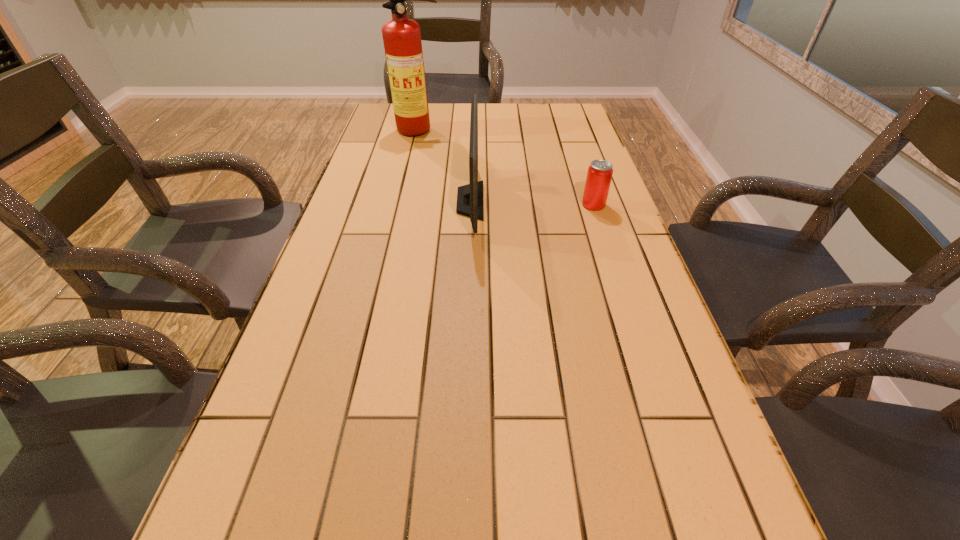
Locate an element on the screen. The image size is (960, 540). object positioned at the left edge is located at coordinates (402, 42).

Where is `object present at the right edge`? The image size is (960, 540). object present at the right edge is located at coordinates tap(599, 175).

What are the coordinates of `object that is positioned at the far left corner` in the screenshot? It's located at (402, 42).

This screenshot has width=960, height=540. In the image, there is a desktop. Find the location of `free region at the far edge`. free region at the far edge is located at coordinates (525, 127).

Identify the location of free space at the left edge of the desktop. (348, 310).

Image resolution: width=960 pixels, height=540 pixels. In order to click on vacant space at the right edge of the desktop in this screenshot , I will do `click(614, 316)`.

This screenshot has height=540, width=960. I want to click on free spot at the far left corner of the desktop, so click(385, 116).

Locate an element on the screen. blank area at the far right corner is located at coordinates (541, 114).

Where is `free space between the second tallest object and the fire extinguisher`? free space between the second tallest object and the fire extinguisher is located at coordinates pyautogui.click(x=444, y=166).

Where is `vacant space in between the can and the tallest object`? This screenshot has height=540, width=960. vacant space in between the can and the tallest object is located at coordinates (507, 167).